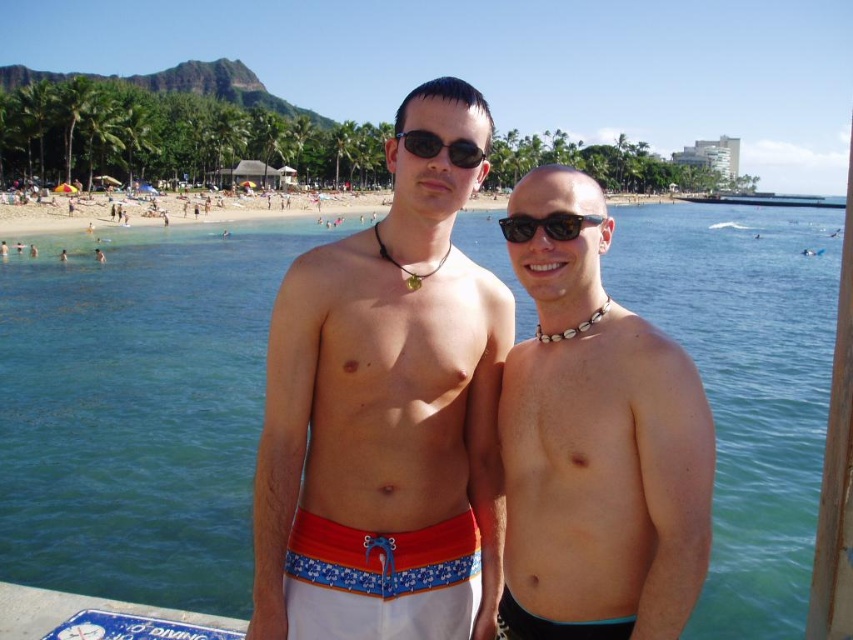
Question: Which point is farther to the camera?

Choices:
 (A) black plastic sunglasses at center
 (B) red and white swim trunks at center
 (C) tortoiseshell plastic sunglasses at center
 (D) brown leather necklace at center

Answer: (A)

Question: Which point is farther to the camera?

Choices:
 (A) tortoiseshell plastic sunglasses at center
 (B) red and white swim trunks at center

Answer: (A)

Question: Does brown leather necklace at center have a greater width compared to red and white swim trunks at center?

Choices:
 (A) no
 (B) yes

Answer: (A)

Question: Can you confirm if beach sand at center is wider than tortoiseshell plastic sunglasses at center?

Choices:
 (A) yes
 (B) no

Answer: (A)

Question: Is clear blue water at center below white swim trunks at center?

Choices:
 (A) no
 (B) yes

Answer: (A)

Question: Which point is farther from the camera taking this photo?

Choices:
 (A) (561, 220)
 (B) (367, 538)
 (C) (618, 456)

Answer: (A)